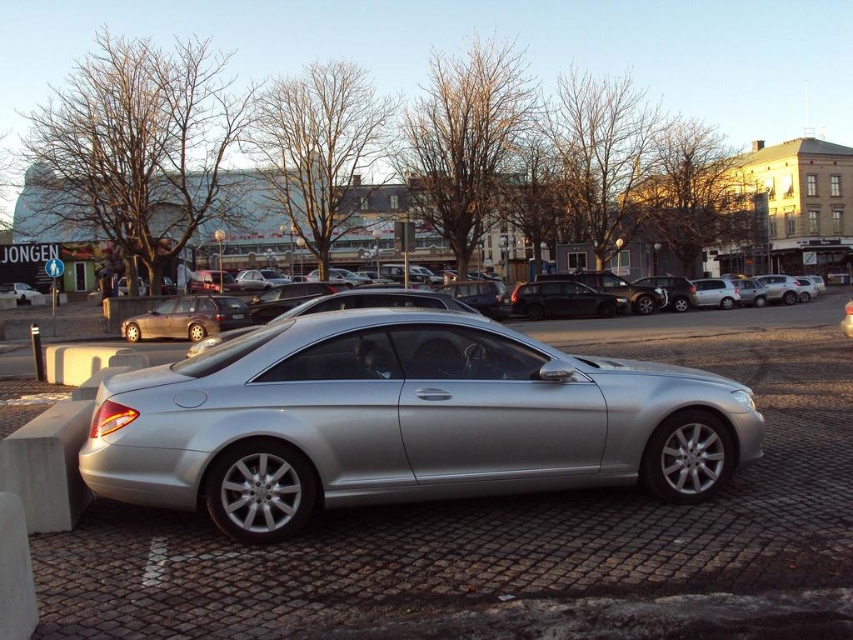
Does matte brown sedan at center lie in front of shiny black sedan at center?

Yes, it is.

The height and width of the screenshot is (640, 853). Find the location of `matte brown sedan at center`. matte brown sedan at center is located at coordinates (184, 317).

At what (x,y) coordinates should I click in order to perform the action: click on matte brown sedan at center. Please return your answer as a coordinate pair (x, y). This screenshot has width=853, height=640. Looking at the image, I should click on (184, 317).

Can you confirm if shiny black sedan at center is thinner than black plastic license plate at center?

No.

Is shiny black sedan at center above black plastic license plate at center?

Correct, shiny black sedan at center is located above black plastic license plate at center.

Identify the location of shiny black sedan at center. (563, 300).

Does point (503, 384) come in front of point (221, 296)?

Yes, point (503, 384) is in front of point (221, 296).

Can you confirm if silver metallic car at center is bigger than matte brown sedan at center?

Correct, silver metallic car at center is larger in size than matte brown sedan at center.

The width and height of the screenshot is (853, 640). Find the location of `silver metallic car at center`. silver metallic car at center is located at coordinates (404, 420).